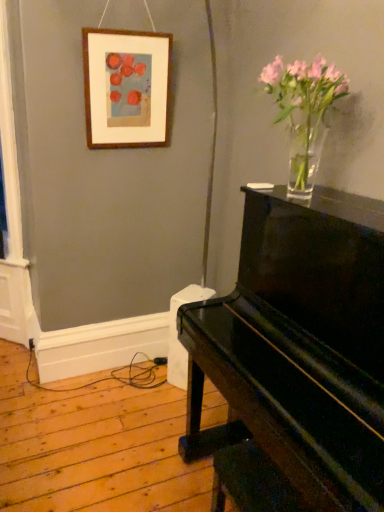
Question: Is wooden picture frame at upper left positioned with its back to clear glass vase at upper right?

Choices:
 (A) yes
 (B) no

Answer: (B)

Question: Could you tell me if wooden picture frame at upper left is turned towards clear glass vase at upper right?

Choices:
 (A) no
 (B) yes

Answer: (B)

Question: Is wooden picture frame at upper left not within clear glass vase at upper right?

Choices:
 (A) no
 (B) yes

Answer: (B)

Question: From the image's perspective, is wooden picture frame at upper left on clear glass vase at upper right?

Choices:
 (A) no
 (B) yes

Answer: (B)

Question: Does wooden picture frame at upper left have a smaller size compared to clear glass vase at upper right?

Choices:
 (A) yes
 (B) no

Answer: (A)

Question: Is wooden picture frame at upper left thinner than clear glass vase at upper right?

Choices:
 (A) no
 (B) yes

Answer: (B)

Question: Is clear glass vase at upper right further to the viewer compared to glossy black piano at right?

Choices:
 (A) no
 (B) yes

Answer: (B)

Question: Would you say clear glass vase at upper right is a long distance from glossy black piano at right?

Choices:
 (A) no
 (B) yes

Answer: (A)

Question: From the image's perspective, would you say clear glass vase at upper right is positioned over glossy black piano at right?

Choices:
 (A) yes
 (B) no

Answer: (A)

Question: Does clear glass vase at upper right have a lesser height compared to glossy black piano at right?

Choices:
 (A) yes
 (B) no

Answer: (A)

Question: Is clear glass vase at upper right placed right next to glossy black piano at right?

Choices:
 (A) yes
 (B) no

Answer: (B)

Question: Can you confirm if clear glass vase at upper right is thinner than glossy black piano at right?

Choices:
 (A) no
 (B) yes

Answer: (B)

Question: Can you confirm if glossy black piano at right is shorter than wooden picture frame at upper left?

Choices:
 (A) no
 (B) yes

Answer: (A)